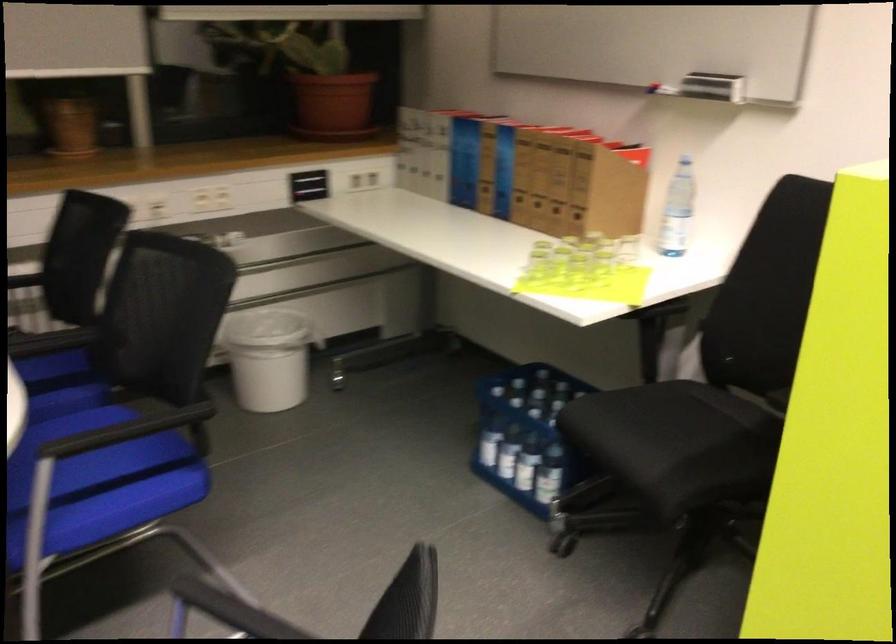
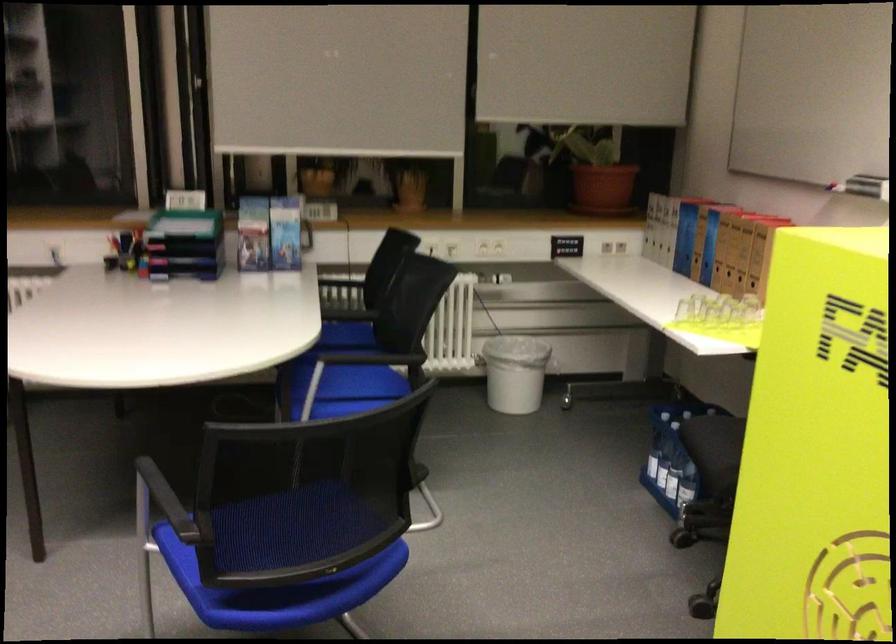
Locate, in the second image, the point that corresponds to [504,451] in the first image.

(661, 465)